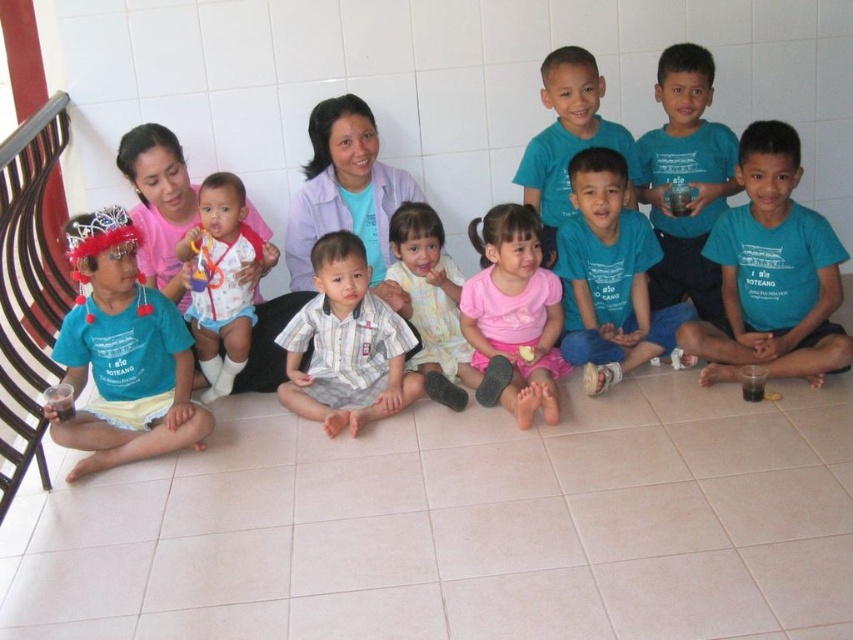
Who is positioned more to the right, matte blue shirt at left or blue cotton shirt at center?

Positioned to the right is blue cotton shirt at center.

Does matte blue shirt at left appear over blue cotton shirt at center?

No, matte blue shirt at left is not above blue cotton shirt at center.

Between point (189, 385) and point (618, 280), which one is positioned behind?

The point (618, 280) is more distant.

This screenshot has height=640, width=853. In order to click on matte blue shirt at left in this screenshot , I will do `click(123, 355)`.

Is point (628, 292) positioned after point (252, 253)?

That is True.

The width and height of the screenshot is (853, 640). I want to click on blue cotton shirt at center, so click(608, 275).

Describe the element at coordinates (608, 275) in the screenshot. I see `blue cotton shirt at center` at that location.

This screenshot has width=853, height=640. I want to click on blue cotton shirt at center, so click(608, 275).

Who is lower down, matte blue shirt at left or matte blue shirt at center?

matte blue shirt at left is lower down.

Who is positioned more to the left, matte blue shirt at left or matte blue shirt at center?

matte blue shirt at left is more to the left.

Is point (77, 257) positioned in front of point (537, 148)?

Yes, point (77, 257) is closer to viewer.

Find the location of a particular element. This screenshot has width=853, height=640. matte blue shirt at left is located at coordinates (123, 355).